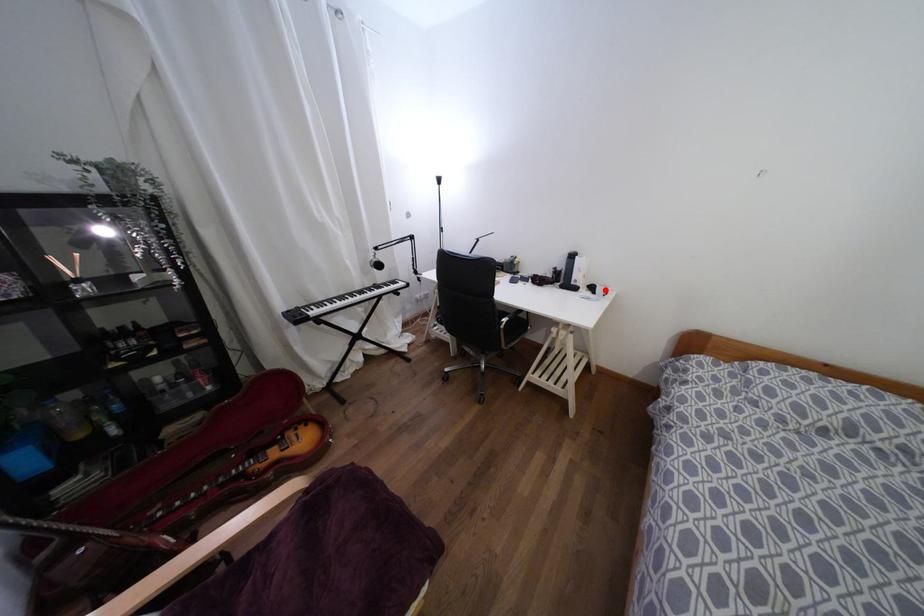
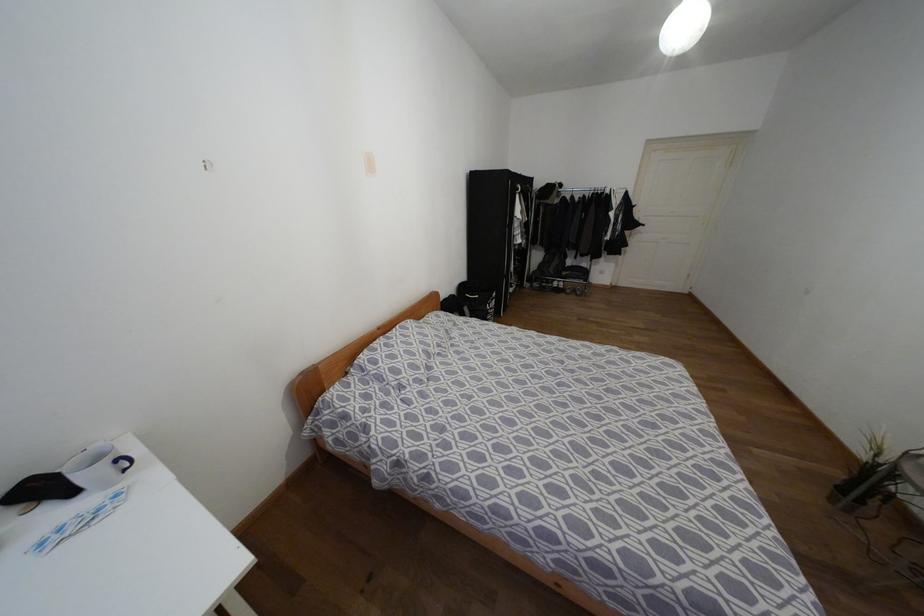
Where in the second image is the point corresponding to the highlighted location from the first image?

(119, 459)